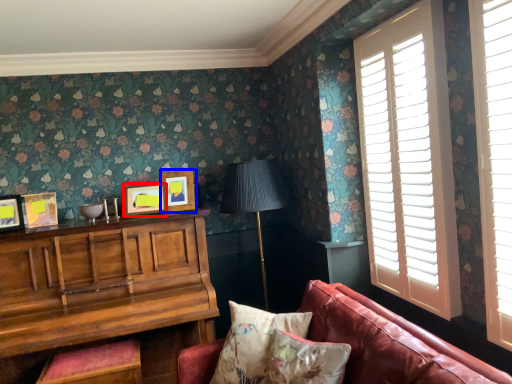
Question: Which point is closer to the camera, picture frame (highlighted by a red box) or picture frame (highlighted by a blue box)?

Choices:
 (A) picture frame
 (B) picture frame

Answer: (A)